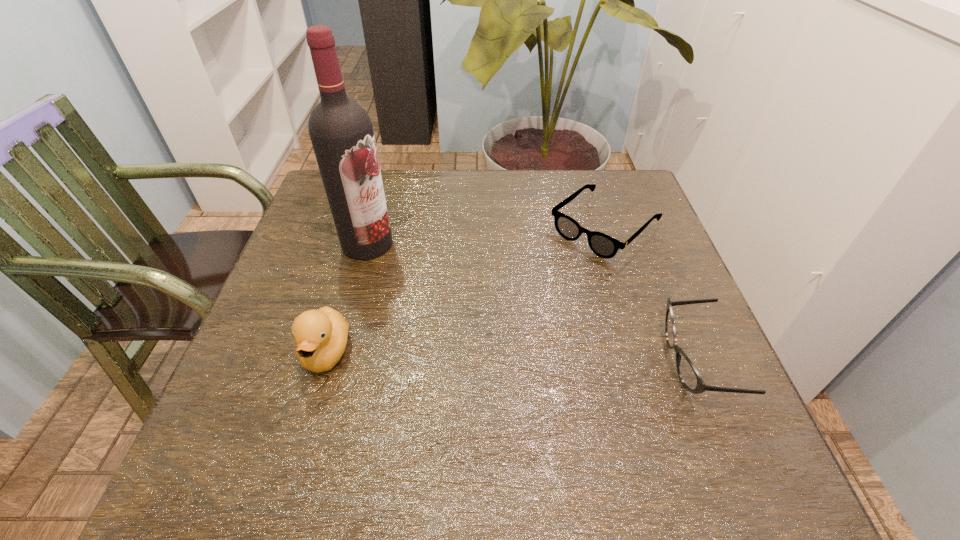
This screenshot has height=540, width=960. I want to click on vacant spot on the desktop that is between the second tallest object and the nearer spectacles and is positioned on the label of the wine bottle, so click(x=486, y=356).

Where is `free spot on the desktop that is between the duckling and the nearer spectacles and is positioned on the arms of the farther spectacles`? Image resolution: width=960 pixels, height=540 pixels. free spot on the desktop that is between the duckling and the nearer spectacles and is positioned on the arms of the farther spectacles is located at coordinates [x=461, y=355].